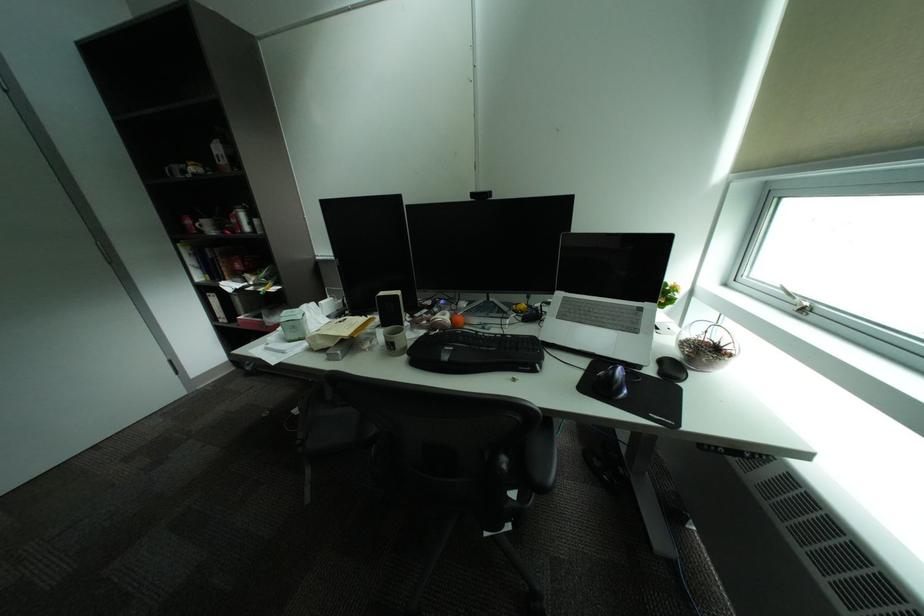
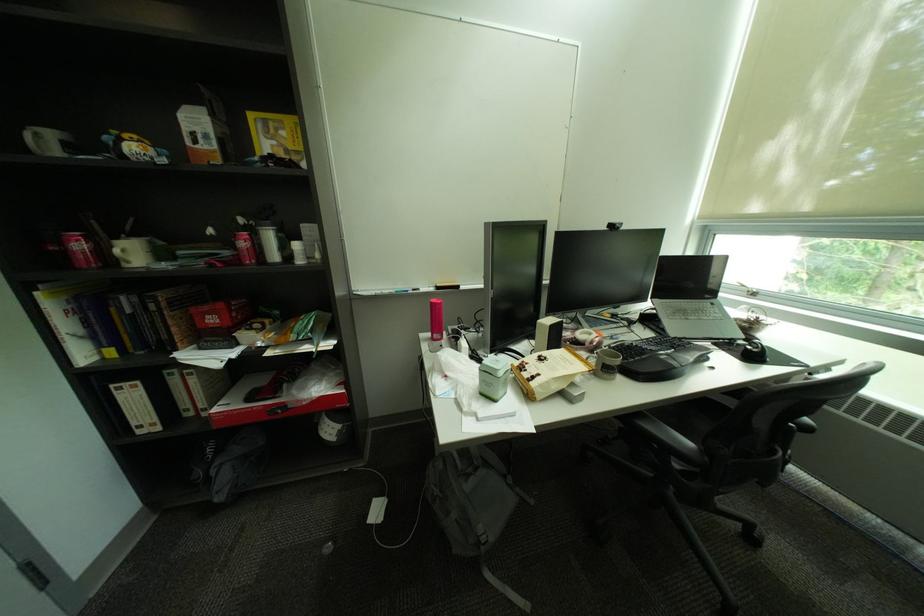
Find the pixel in the second image that matches the point at 483,197 in the first image.

(621, 227)